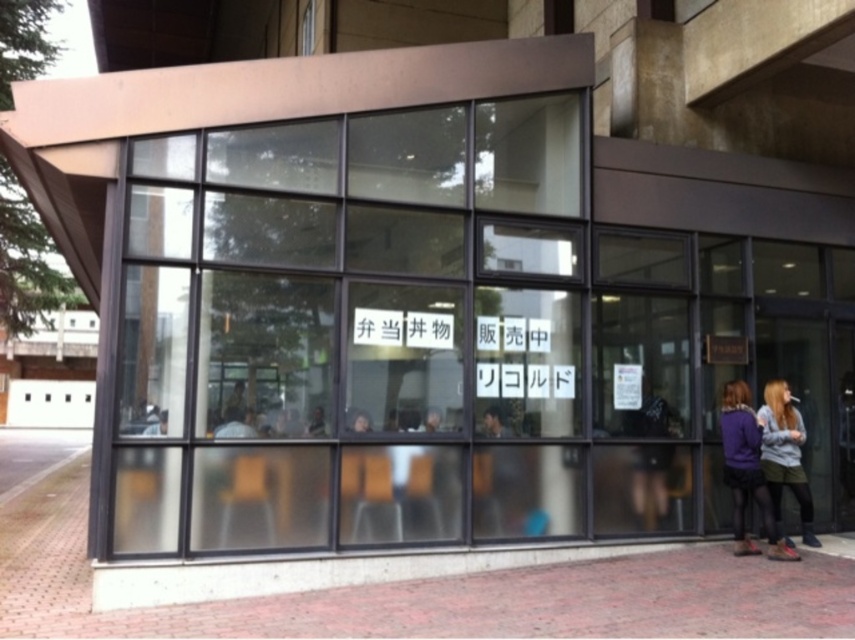
Between transparent glass window at center and brick pavement at lower center, which one is positioned higher?

transparent glass window at center

Consider the image. Is transparent glass window at center shorter than brick pavement at lower center?

No, transparent glass window at center is not shorter than brick pavement at lower center.

Is point (394, 540) closer to camera compared to point (833, 561)?

That is True.

Find the location of a particular element. This screenshot has width=855, height=640. transparent glass window at center is located at coordinates (340, 320).

How far apart are brick pavement at lower center and matte purple hoodie at lower right?

A distance of 1.51 meters exists between brick pavement at lower center and matte purple hoodie at lower right.

Can you confirm if brick pavement at lower center is wider than matte purple hoodie at lower right?

Indeed, brick pavement at lower center has a greater width compared to matte purple hoodie at lower right.

Is point (358, 636) closer to viewer compared to point (738, 400)?

Yes, point (358, 636) is in front of point (738, 400).

This screenshot has height=640, width=855. I want to click on brick pavement at lower center, so click(426, 592).

Does point (390, 310) come farther from viewer compared to point (736, 488)?

No, (390, 310) is in front of (736, 488).

Who is more forward, (579, 269) or (787, 388)?

Positioned in front is point (579, 269).

Find the location of `transparent glass window at center`. transparent glass window at center is located at coordinates (340, 320).